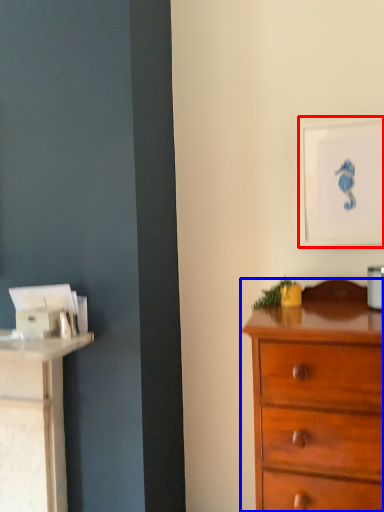
Question: Among these objects, which one is farthest to the camera, picture frame (highlighted by a red box) or chest of drawers (highlighted by a blue box)?

Choices:
 (A) picture frame
 (B) chest of drawers

Answer: (A)